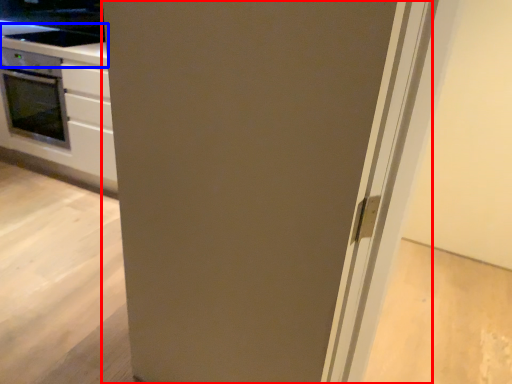
Question: Which point is closer to the camera, door (highlighted by a red box) or counter top (highlighted by a blue box)?

Choices:
 (A) door
 (B) counter top

Answer: (A)